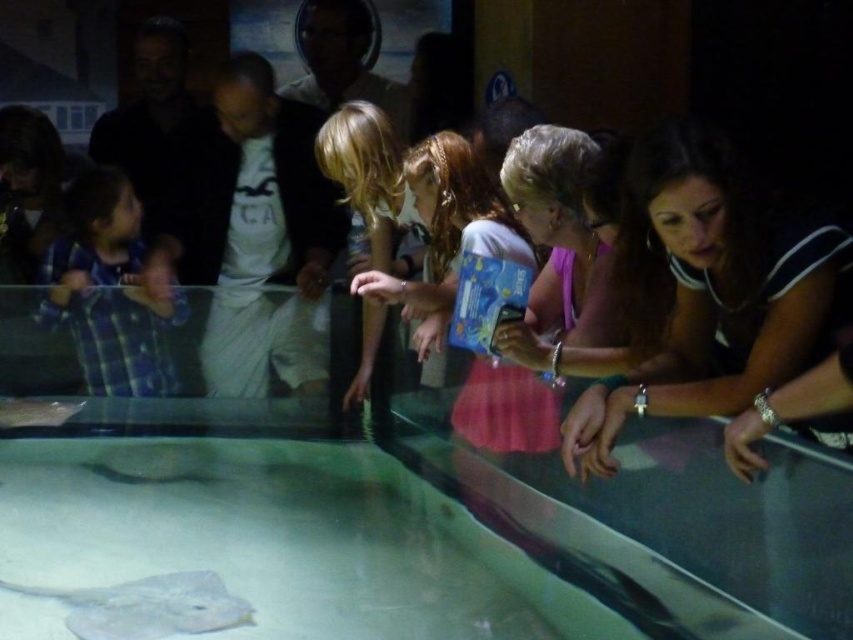
You are standing in front of the aquarium tank and notice a blue plaid shirt at left. Can you determine the exact coordinates of where this shirt is positioned relative to the tank?

The blue plaid shirt at left is located at point coordinates (x=111, y=291).

You are a photographer standing behind the group of people at the aquarium. You want to take a photo of the gray matte stingray at lower left without any people blocking the view. Is the blonde hair at center likely to block the stingray in the photo?

The blonde hair at center is much taller than the gray matte stingray at lower left, so it is likely blocking the view of the stingray in the photo.